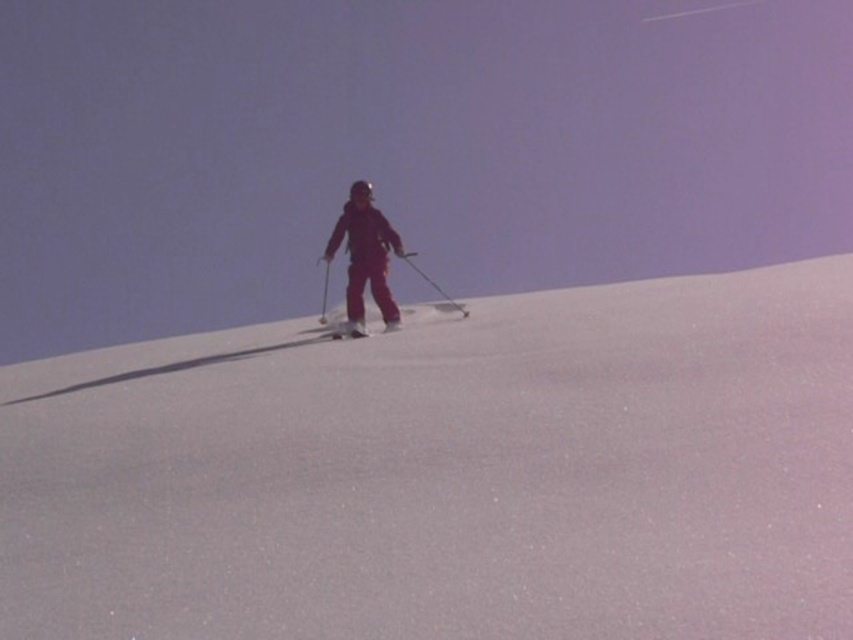
Question: Estimate the real-world distances between objects in this image. Which object is closer to the white powder snow at center?

Choices:
 (A) white matte ski at center
 (B) matte red ski suit at center

Answer: (B)

Question: Does white powder snow at center lie behind white matte ski at center?

Choices:
 (A) no
 (B) yes

Answer: (A)

Question: Is matte red ski suit at center to the right of white matte ski at center from the viewer's perspective?

Choices:
 (A) yes
 (B) no

Answer: (A)

Question: Among these objects, which one is nearest to the camera?

Choices:
 (A) matte red ski suit at center
 (B) white matte ski at center
 (C) white powder snow at center

Answer: (C)

Question: Which is nearer to the white matte ski at center?

Choices:
 (A) white powder snow at center
 (B) matte red ski suit at center

Answer: (B)

Question: Is white powder snow at center in front of matte red ski suit at center?

Choices:
 (A) yes
 (B) no

Answer: (A)